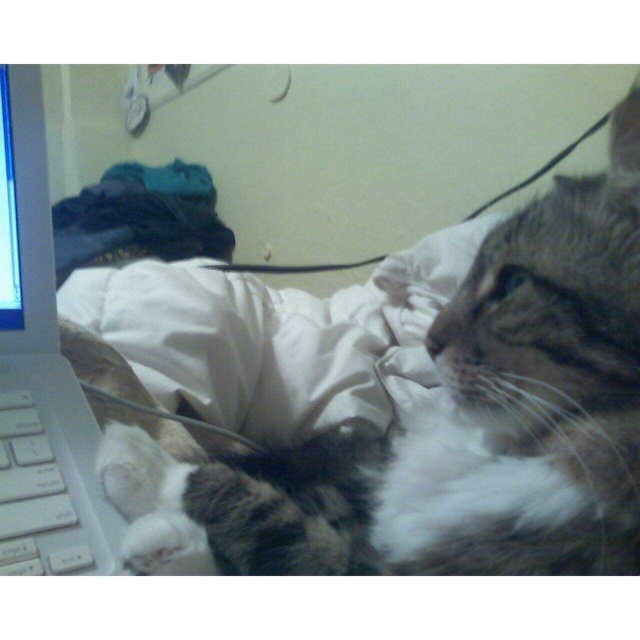
Can you confirm if tabby fur cat at center is smaller than white plastic keyboard at left?

No.

Between point (547, 195) and point (13, 188), which one is positioned behind?

Point (547, 195)

Which is in front, point (625, 552) or point (88, 452)?

Point (625, 552) is in front.

In order to click on tabby fur cat at center in this screenshot , I will do `click(433, 424)`.

Which is in front, point (528, 291) or point (67, 524)?

Positioned in front is point (528, 291).

Can you confirm if tabby fur cat at center is positioned to the right of white plastic keyboard at lower left?

Correct, you'll find tabby fur cat at center to the right of white plastic keyboard at lower left.

Where is `tabby fur cat at center`? This screenshot has width=640, height=640. tabby fur cat at center is located at coordinates (433, 424).

Is white plastic keyboard at left behind white plastic keyboard at lower left?

That is True.

Is point (12, 173) positioned before point (51, 515)?

No, it is behind (51, 515).

Image resolution: width=640 pixels, height=640 pixels. In order to click on white plastic keyboard at left in this screenshot , I will do `click(38, 372)`.